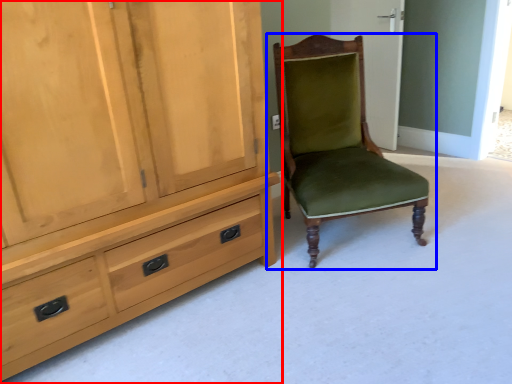
Question: Which of the following is the farthest to the observer, cabinetry (highlighted by a red box) or chair (highlighted by a blue box)?

Choices:
 (A) cabinetry
 (B) chair

Answer: (B)